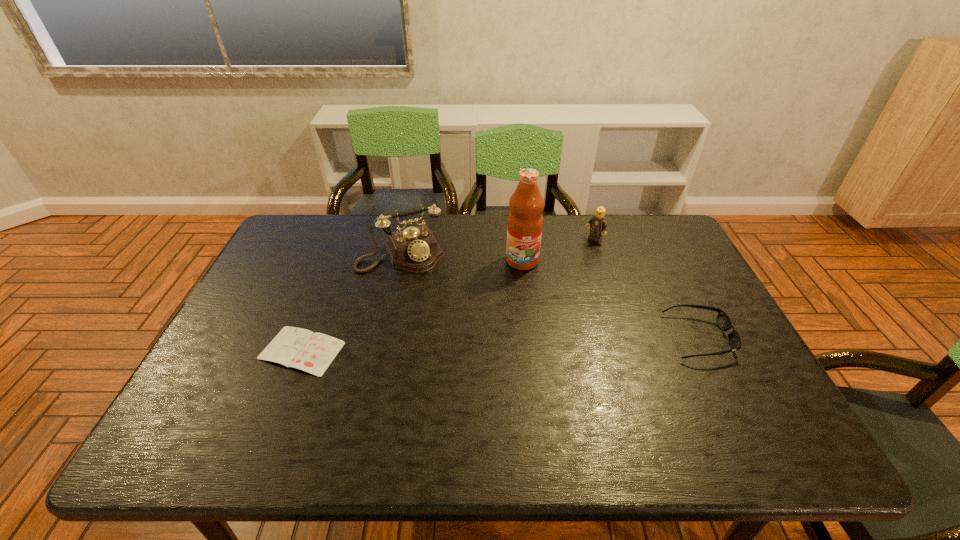
This screenshot has width=960, height=540. I want to click on vacant region between the shortest object and the tallest object, so click(x=412, y=306).

You are a GUI agent. You are given a task and a screenshot of the screen. Output one action in this format:
    pyautogui.click(x=<x>, y=<y>)
    Task: Click on the free space between the third shortest object and the sunglasses
    The height and width of the screenshot is (540, 960).
    Given the screenshot: What is the action you would take?
    pyautogui.click(x=647, y=288)

You are a GUI agent. You are given a task and a screenshot of the screen. Output one action in this format:
    pyautogui.click(x=<x>, y=<y>)
    Task: Click on the free space between the diary and the third tallest object
    This screenshot has height=540, width=960.
    Given the screenshot: What is the action you would take?
    pyautogui.click(x=448, y=295)

Find the location of a particular element. This screenshot has width=960, height=540. free space between the telephone and the third tallest object is located at coordinates (497, 246).

Find the location of a particular element. Image resolution: width=960 pixels, height=540 pixels. vacant area between the diary and the fruit juice is located at coordinates (412, 306).

Find the location of a particular element. The image size is (960, 540). vacant point located between the second tallest object and the Lego is located at coordinates (497, 246).

Identify the location of free space between the diary and the third shortest object. The height and width of the screenshot is (540, 960). (448, 295).

At what (x,y) coordinates should I click in order to perform the action: click on vacant area that lies between the tallest object and the shortest object. Please return your answer as a coordinate pair (x, y). This screenshot has width=960, height=540. Looking at the image, I should click on (412, 306).

Where is `vacant area that lies between the second object from right to left and the shortest object`? vacant area that lies between the second object from right to left and the shortest object is located at coordinates (448, 295).

Locate an element on the screen. object identified as the fourth closest to the fruit juice is located at coordinates (298, 348).